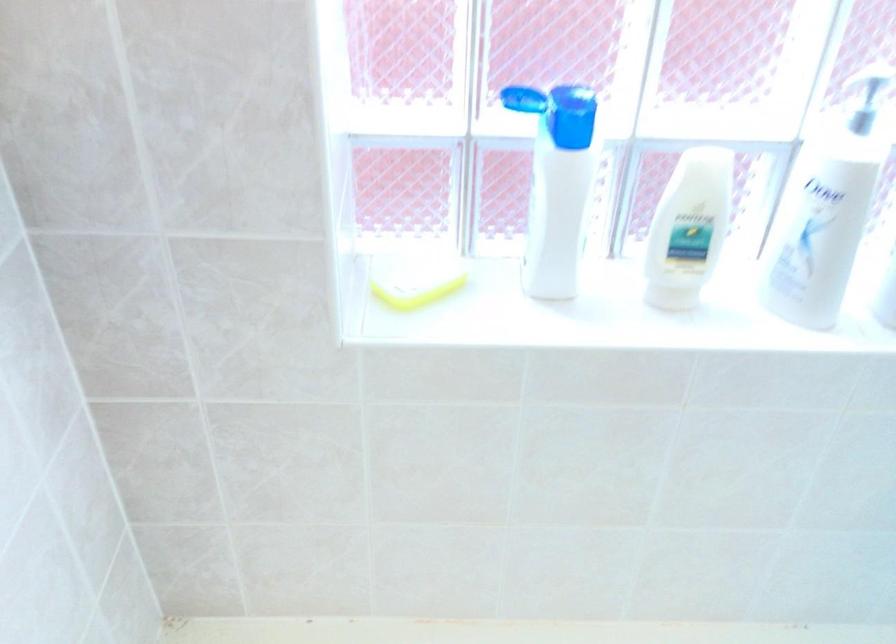
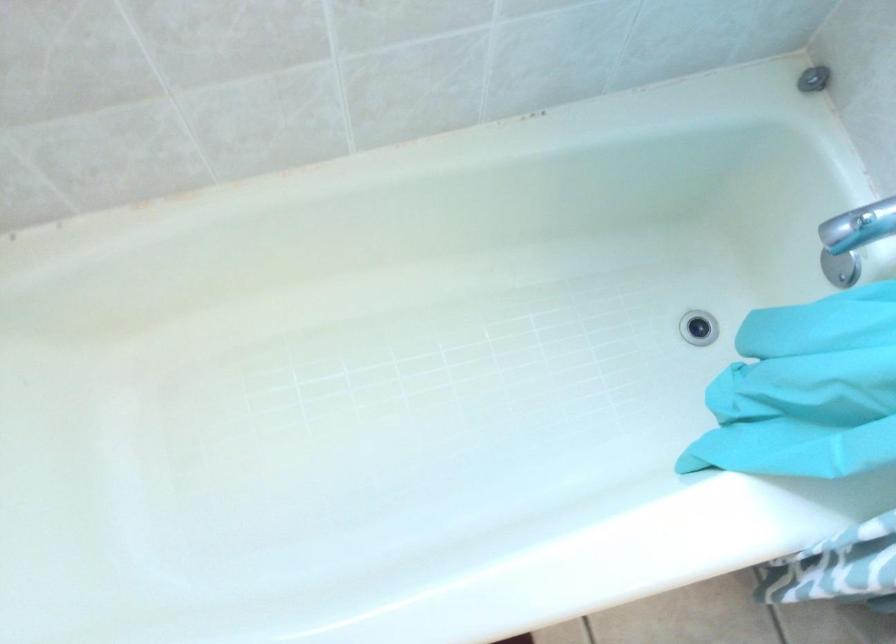
Question: The images are taken continuously from a first-person perspective. In which direction is your viewpoint rotating?

Choices:
 (A) Left
 (B) Right
 (C) Up
 (D) Down

Answer: (D)